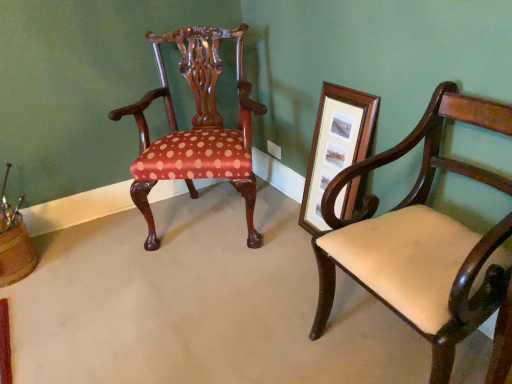
Question: Would you say wooden picture frame at right is outside polished wood chair at center, the first chair from the back?

Choices:
 (A) no
 (B) yes

Answer: (B)

Question: Is wooden picture frame at right behind polished wood chair at center, arranged as the second chair when viewed from the front?

Choices:
 (A) no
 (B) yes

Answer: (A)

Question: From the image's perspective, is wooden picture frame at right on polished wood chair at center, which is counted as the 1th chair, starting from the left?

Choices:
 (A) no
 (B) yes

Answer: (A)

Question: Could you tell me if wooden picture frame at right is turned towards polished wood chair at center, which is counted as the second chair, starting from the right?

Choices:
 (A) yes
 (B) no

Answer: (B)

Question: Would you say wooden picture frame at right is a long distance from polished wood chair at center, which is counted as the second chair, starting from the right?

Choices:
 (A) no
 (B) yes

Answer: (A)

Question: Is wooden picture frame at right turned away from polished wood chair at center, which is counted as the second chair, starting from the right?

Choices:
 (A) no
 (B) yes

Answer: (A)

Question: Is polished wood chair at center, which is counted as the 1th chair, starting from the left, positioned before wooden picture frame at right?

Choices:
 (A) yes
 (B) no

Answer: (B)

Question: Considering the relative sizes of polished wood chair at center, which is counted as the second chair, starting from the right, and wooden picture frame at right in the image provided, is polished wood chair at center, which is counted as the second chair, starting from the right, smaller than wooden picture frame at right?

Choices:
 (A) yes
 (B) no

Answer: (B)

Question: Is polished wood chair at center, which is counted as the 1th chair, starting from the left, wider than wooden picture frame at right?

Choices:
 (A) no
 (B) yes

Answer: (B)

Question: Is polished wood chair at center, arranged as the second chair when viewed from the front, to the right of wooden picture frame at right from the viewer's perspective?

Choices:
 (A) no
 (B) yes

Answer: (A)

Question: From a real-world perspective, is polished wood chair at center, arranged as the second chair when viewed from the front, under wooden picture frame at right?

Choices:
 (A) no
 (B) yes

Answer: (A)

Question: Is polished wood chair at center, the first chair from the back, outside wooden picture frame at right?

Choices:
 (A) no
 (B) yes

Answer: (B)

Question: Does wooden picture frame at right have a larger size compared to matte cream upholstered chair at right, marked as the second chair in a left-to-right arrangement?

Choices:
 (A) no
 (B) yes

Answer: (A)